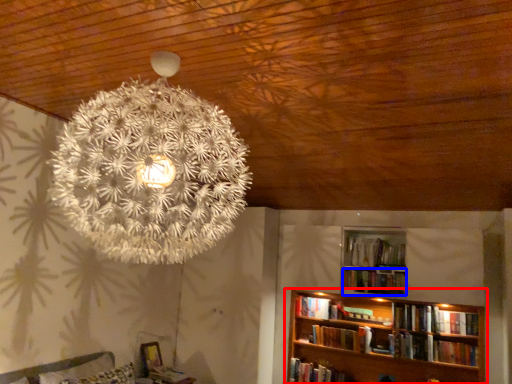
Question: Which point is closer to the camera, bookcase (highlighted by a red box) or book (highlighted by a blue box)?

Choices:
 (A) bookcase
 (B) book

Answer: (A)